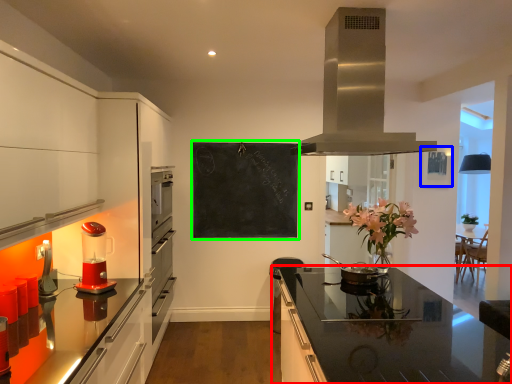
Question: Estimate the real-world distances between objects in this image. Which object is closer to countertop (highlighted by a red box), picture frame (highlighted by a blue box) or bulletin board (highlighted by a green box)?

Choices:
 (A) picture frame
 (B) bulletin board

Answer: (B)